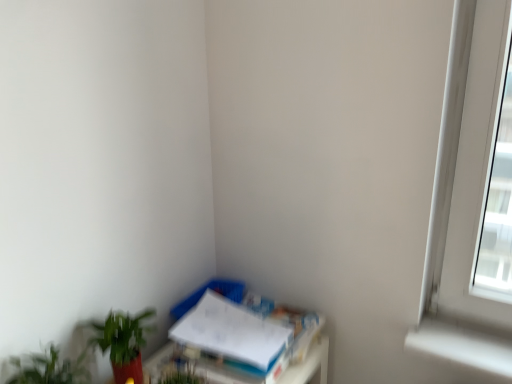
Question: Would you say green matte plant at lower left, which appears as the first houseplant when viewed from the back, contains white paper at lower right?

Choices:
 (A) yes
 (B) no

Answer: (B)

Question: Is green matte plant at lower left, which appears as the first houseplant when viewed from the back, in contact with white paper at lower right?

Choices:
 (A) no
 (B) yes

Answer: (A)

Question: From the image's perspective, is green matte plant at lower left, which appears as the first houseplant when viewed from the back, below white paper at lower right?

Choices:
 (A) no
 (B) yes

Answer: (A)

Question: From the image's perspective, does green matte plant at lower left, which is the 2th houseplant in front-to-back order, appear higher than white paper at lower right?

Choices:
 (A) no
 (B) yes

Answer: (B)

Question: Does green matte plant at lower left, which is the 2th houseplant in front-to-back order, have a larger size compared to white paper at lower right?

Choices:
 (A) no
 (B) yes

Answer: (A)

Question: From a real-world perspective, is green matte plant at lower left, which appears as the first houseplant when viewed from the back, over white paper at lower right?

Choices:
 (A) no
 (B) yes

Answer: (B)

Question: Is the depth of green matte plant at lower left, which appears as the first houseplant when viewed from the back, greater than that of green leafy plant at lower left, acting as the 1th houseplant starting from the front?

Choices:
 (A) no
 (B) yes

Answer: (B)

Question: Can you confirm if green matte plant at lower left, which appears as the first houseplant when viewed from the back, is smaller than green leafy plant at lower left, acting as the second houseplant starting from the back?

Choices:
 (A) no
 (B) yes

Answer: (A)

Question: From a real-world perspective, is green matte plant at lower left, which is the 2th houseplant in front-to-back order, positioned under green leafy plant at lower left, acting as the 1th houseplant starting from the front, based on gravity?

Choices:
 (A) no
 (B) yes

Answer: (B)

Question: Can you confirm if green matte plant at lower left, which is the 2th houseplant in front-to-back order, is thinner than green leafy plant at lower left, acting as the second houseplant starting from the back?

Choices:
 (A) no
 (B) yes

Answer: (B)

Question: Is there a large distance between green matte plant at lower left, which appears as the first houseplant when viewed from the back, and green leafy plant at lower left, acting as the 1th houseplant starting from the front?

Choices:
 (A) no
 (B) yes

Answer: (A)

Question: From a real-world perspective, does green matte plant at lower left, which appears as the first houseplant when viewed from the back, stand above green leafy plant at lower left, acting as the second houseplant starting from the back?

Choices:
 (A) yes
 (B) no

Answer: (B)

Question: Considering the relative positions of white paper at lower right and green matte plant at lower left, which appears as the first houseplant when viewed from the back, in the image provided, is white paper at lower right behind green matte plant at lower left, which appears as the first houseplant when viewed from the back,?

Choices:
 (A) yes
 (B) no

Answer: (A)